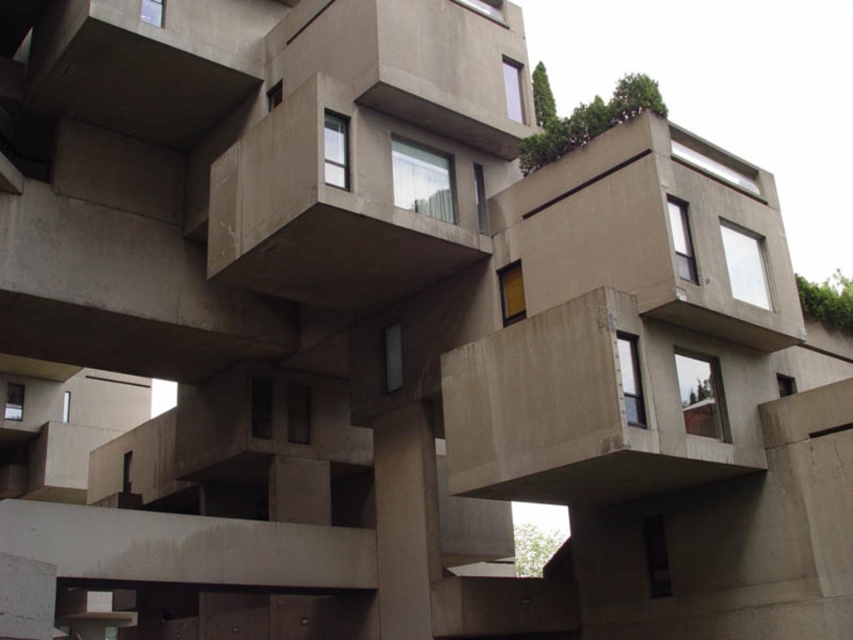
Is concrete at center thinner than concrete balcony at center?

Incorrect, concrete at center's width is not less than concrete balcony at center's.

Which is in front, point (508, 412) or point (354, 195)?

Point (508, 412)

What do you see at coordinates (581, 410) in the screenshot? The height and width of the screenshot is (640, 853). I see `concrete at center` at bounding box center [581, 410].

At what (x,y) coordinates should I click in order to perform the action: click on concrete at center. Please return your answer as a coordinate pair (x, y). The image size is (853, 640). Looking at the image, I should click on (581, 410).